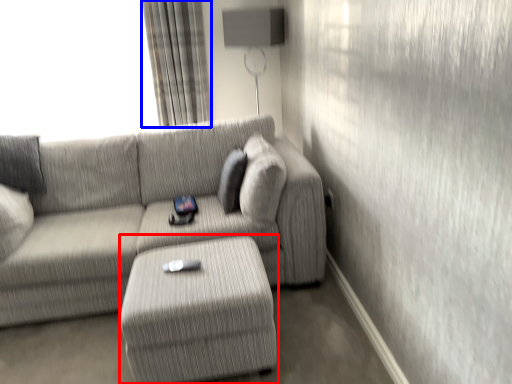
Question: Which point is closer to the camera, table (highlighted by a red box) or curtain (highlighted by a blue box)?

Choices:
 (A) table
 (B) curtain

Answer: (A)